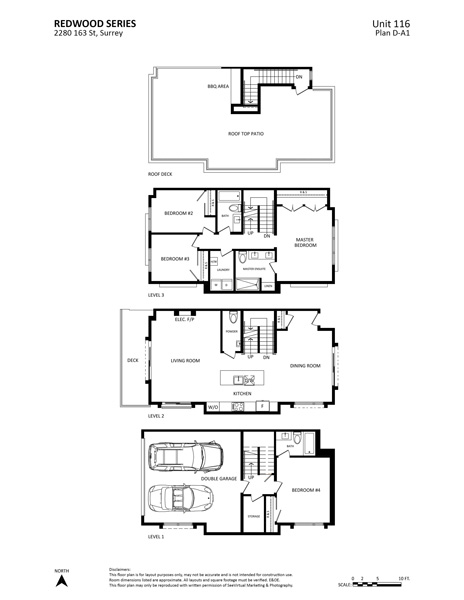
What are the coordinates of `toilets` in the screenshot? It's located at (233, 207), (242, 256), (297, 437), (236, 318).